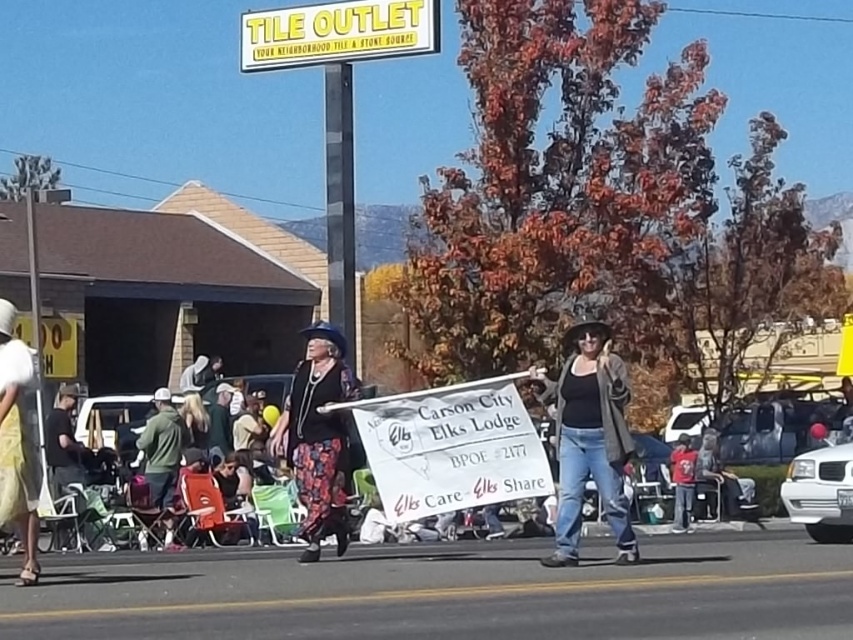
Is floral-patterned pants at center closer to camera compared to red cotton shirt at center?

Yes, floral-patterned pants at center is in front of red cotton shirt at center.

Is floral-patterned pants at center behind red cotton shirt at center?

No, it is not.

Is point (300, 458) less distant than point (674, 509)?

Yes, it is.

I want to click on floral-patterned pants at center, so click(x=317, y=436).

How much distance is there between floral-patterned pants at center and yellow fabric skirt at lower left?

floral-patterned pants at center and yellow fabric skirt at lower left are 3.25 meters apart.

Is floral-patterned pants at center positioned at the back of yellow fabric skirt at lower left?

That is True.

Find the location of a particular element. Image resolution: width=853 pixels, height=640 pixels. floral-patterned pants at center is located at coordinates (317, 436).

Based on the photo, between yellow plastic sign at upper center and red cotton shirt at center, which one has more height?

Standing taller between the two is yellow plastic sign at upper center.

Is yellow plastic sign at upper center positioned before red cotton shirt at center?

Yes, yellow plastic sign at upper center is in front of red cotton shirt at center.

Is point (323, 32) behind point (694, 451)?

No.

At what (x,y) coordinates should I click in order to perform the action: click on yellow plastic sign at upper center. Please return your answer as a coordinate pair (x, y). This screenshot has width=853, height=640. Looking at the image, I should click on (337, 33).